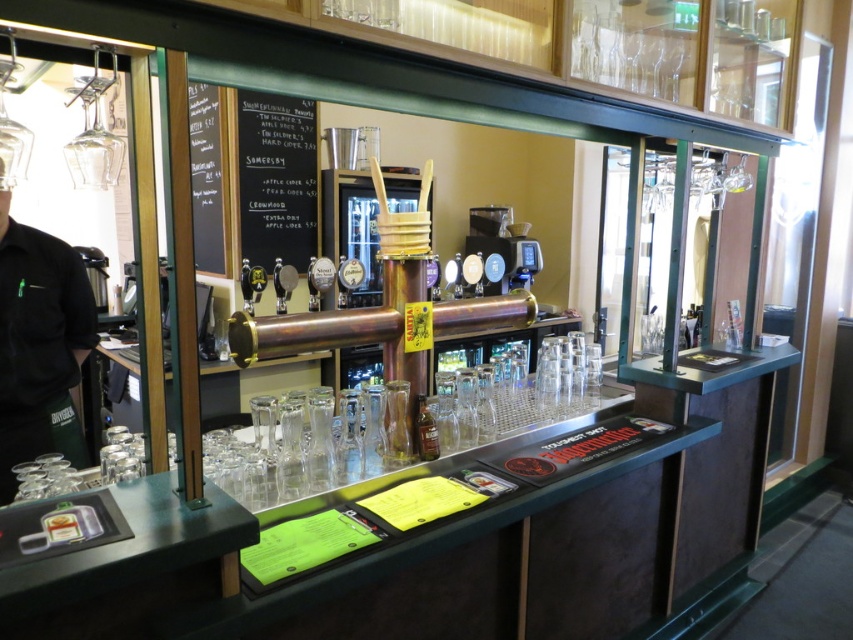
You are a barista working at the bar and need to hang a new menu. The menu is taller than the black plastic coffee machine at center. Will it fit vertically above the black chalkboard at center?

The black chalkboard at center is taller than the black plastic coffee machine at center. Since the menu is taller than the coffee machine, it may not fit vertically above the chalkboard unless the chalkboard has enough space. However, since the chalkboard itself is taller than the coffee machine, if the menu is shorter than the chalkboard, it might fit. But without exact measurements, it is uncertain. However, according to the given information, the menu is only stated to be taller than the coffee machine,

You are a bartender who needs to reach both the black chalkboard at upper left and the clear glass bottle at center. The longest tool you have is a 2 meter pole. Can you use it to reach both items without moving the pole?

The black chalkboard at upper left is 2.14 meters from the clear glass bottle at center. Since the pole is only 2 meters long, it is 14 centimeters too short to reach both items simultaneously.

You are a customer at the bar and want to order a drink. You see the black fabric shirt at left and the black chalkboard at upper left. Which object is closer to the bar counter?

The black fabric shirt at left is closer to the bar counter because it is positioned below the black chalkboard at upper left, which is higher up.